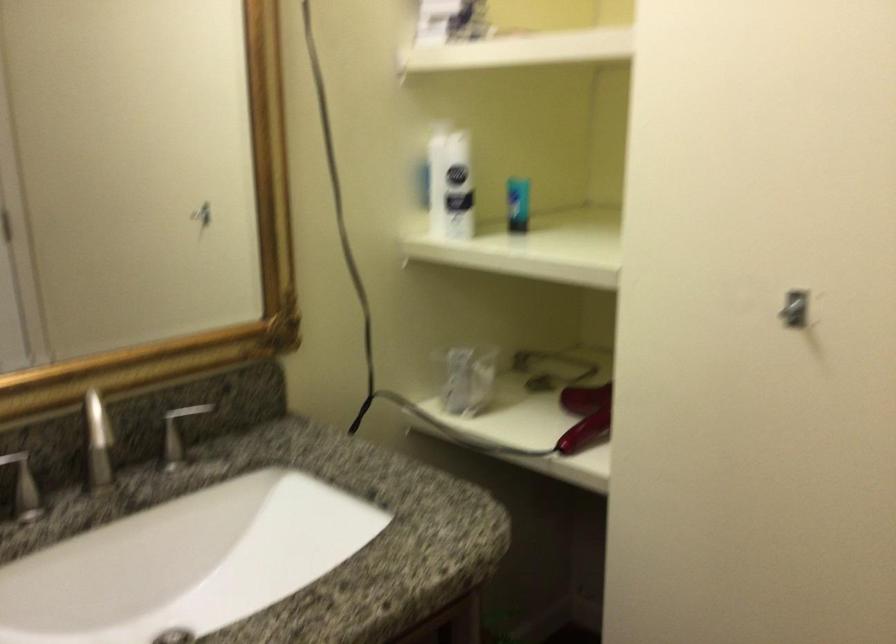
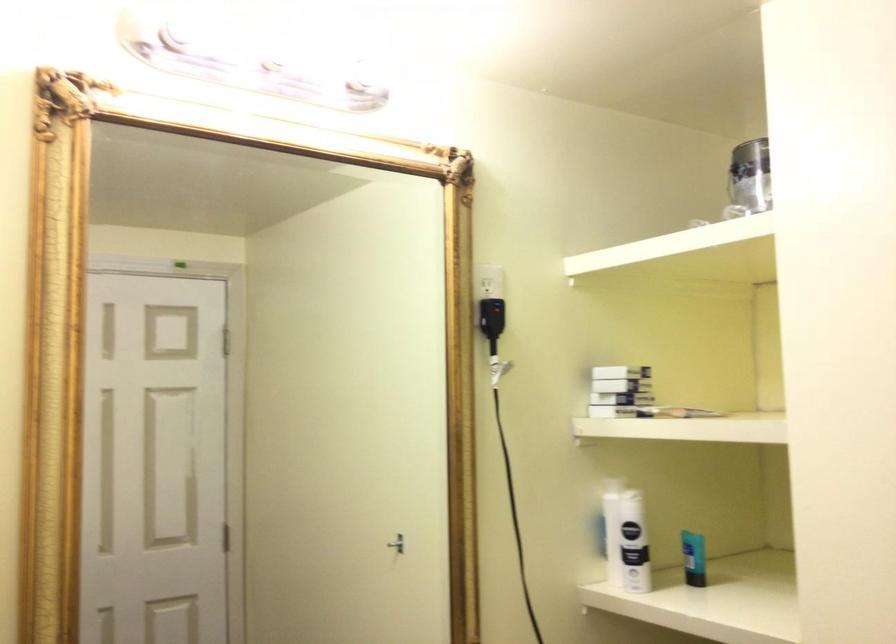
The point at (518, 202) is marked in the first image. Where is the corresponding point in the second image?

(693, 558)